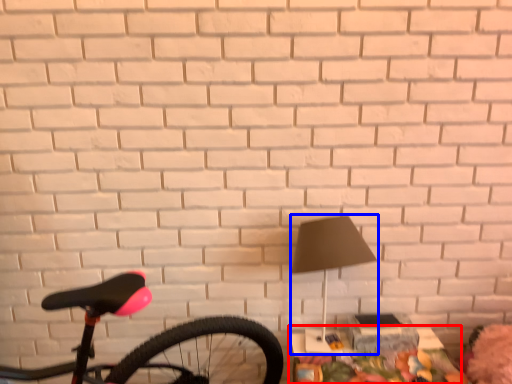
Question: Which object is further to the camera taking this photo, table (highlighted by a red box) or lamp (highlighted by a blue box)?

Choices:
 (A) table
 (B) lamp

Answer: (A)